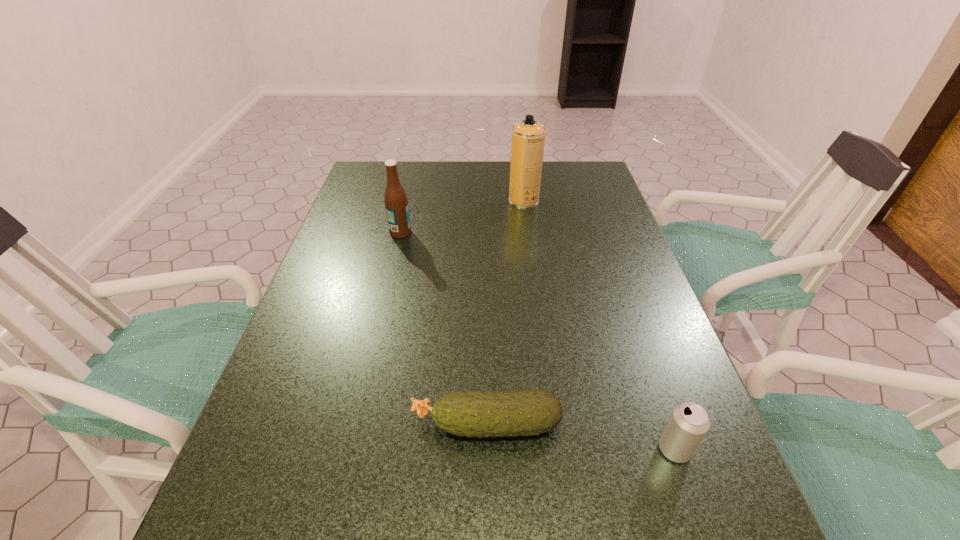
In the image, there is a desktop. Where is `vacant area at the far right corner`? The width and height of the screenshot is (960, 540). vacant area at the far right corner is located at coordinates (568, 195).

I want to click on unoccupied position between the shortest object and the aerosol can, so click(x=505, y=312).

Locate an element on the screen. free space between the tallest object and the third nearest object is located at coordinates (462, 216).

Image resolution: width=960 pixels, height=540 pixels. Find the location of `empty location between the shortest object and the tallest object`. empty location between the shortest object and the tallest object is located at coordinates (505, 312).

Where is `free spot between the beer bottle and the cucumber`? This screenshot has height=540, width=960. free spot between the beer bottle and the cucumber is located at coordinates (444, 328).

At what (x,y) coordinates should I click in order to perform the action: click on free space between the cucumber and the third tallest object. Please return your answer as a coordinate pair (x, y). This screenshot has width=960, height=540. Looking at the image, I should click on (581, 436).

What are the coordinates of `free point between the leftmost object and the farthest object` in the screenshot? It's located at (462, 216).

The image size is (960, 540). I want to click on free area in between the shortest object and the beer can, so click(x=581, y=436).

The height and width of the screenshot is (540, 960). Identify the location of free space between the beer can and the cucumber. (x=581, y=436).

This screenshot has width=960, height=540. Identify the location of free space between the beer bottle and the aerosol can. (462, 216).